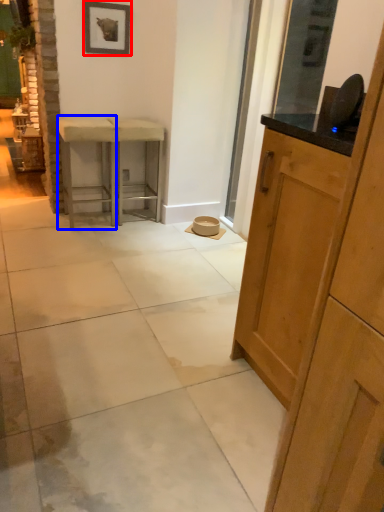
Question: Among these objects, which one is nearest to the camera, picture frame (highlighted by a red box) or stool (highlighted by a blue box)?

Choices:
 (A) picture frame
 (B) stool

Answer: (B)